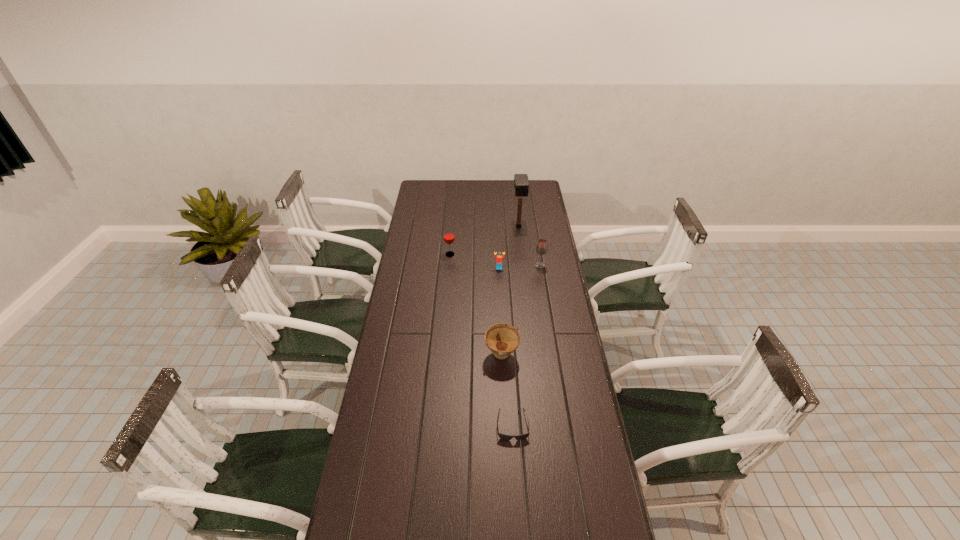
In the image, there is a desktop. Where is `blank space at the left edge`? The image size is (960, 540). blank space at the left edge is located at coordinates (381, 351).

Find the location of `vacant point at the right edge`. vacant point at the right edge is located at coordinates (572, 516).

This screenshot has height=540, width=960. Identify the location of vacant space at the far left corner of the desktop. (431, 198).

Where is `vacant space at the far right corner of the desktop`? The height and width of the screenshot is (540, 960). vacant space at the far right corner of the desktop is located at coordinates point(530,193).

Where is `empty space that is in between the nearer glass and the shortest object`? The width and height of the screenshot is (960, 540). empty space that is in between the nearer glass and the shortest object is located at coordinates (526, 346).

The image size is (960, 540). What are the coordinates of `empty space that is in between the second farthest object and the sunglasses` in the screenshot? It's located at (481, 340).

Where is `free spot between the nearest object and the fifth object from left to right`? This screenshot has width=960, height=540. free spot between the nearest object and the fifth object from left to right is located at coordinates (516, 325).

Find the location of a particular element. The image size is (960, 540). vacant point located between the farthest object and the Lego is located at coordinates (509, 247).

Locate an element on the screen. This screenshot has width=960, height=540. free spot between the right glass and the fifth nearest object is located at coordinates (495, 260).

Find the location of `free spot between the fifth object from left to right and the nearer glass`. free spot between the fifth object from left to right and the nearer glass is located at coordinates (529, 246).